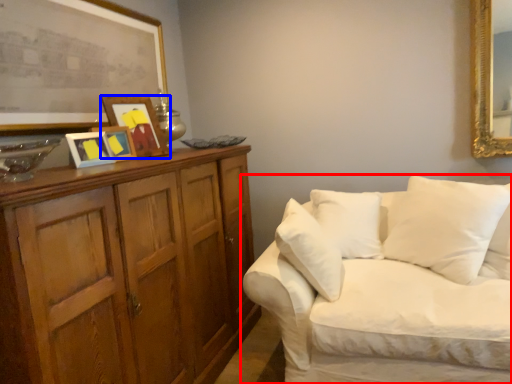
Question: Which object is further to the camera taking this photo, studio couch (highlighted by a red box) or picture frame (highlighted by a blue box)?

Choices:
 (A) studio couch
 (B) picture frame

Answer: (B)